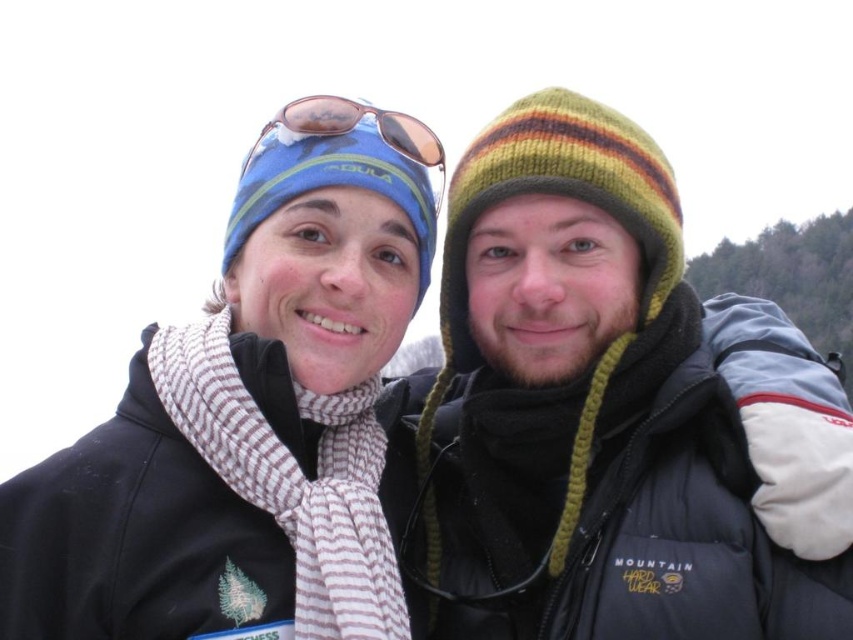
Which is above, white striped scarf at center or knitted woolen beanie at right?

knitted woolen beanie at right is above.

Does white striped scarf at center lie behind knitted woolen beanie at right?

That is False.

What are the coordinates of `white striped scarf at center` in the screenshot? It's located at (293, 480).

Is point (332, 412) positioned after point (418, 144)?

No, (332, 412) is closer to viewer.

What do you see at coordinates (293, 480) in the screenshot? I see `white striped scarf at center` at bounding box center [293, 480].

Is point (283, 484) farther from viewer compared to point (315, 99)?

No, (283, 484) is in front of (315, 99).

The height and width of the screenshot is (640, 853). In order to click on white striped scarf at center in this screenshot , I will do point(293,480).

Is knitted woolen beanie at right positioned in front of sunglasses at upper center?

Yes, knitted woolen beanie at right is closer to the viewer.

The width and height of the screenshot is (853, 640). I want to click on knitted woolen beanie at right, so click(x=554, y=193).

The height and width of the screenshot is (640, 853). What are the coordinates of `knitted woolen beanie at right` in the screenshot? It's located at (554, 193).